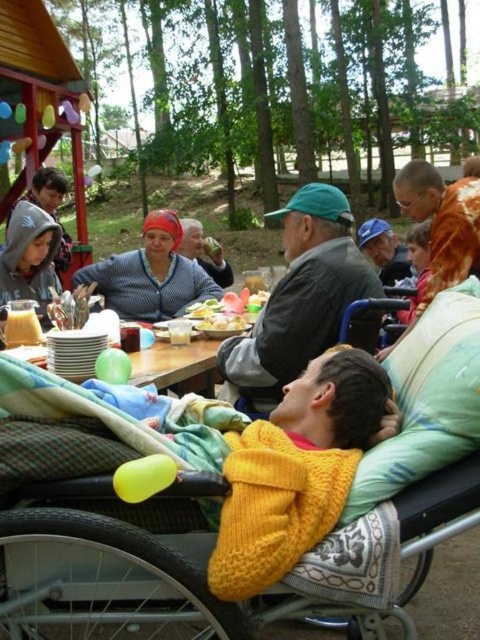
Based on the photo, can you confirm if yellow knitted baby carriage at center is wider than black plastic wheelchair at center?

Yes, yellow knitted baby carriage at center is wider than black plastic wheelchair at center.

Does yellow knitted baby carriage at center appear on the right side of black plastic wheelchair at center?

Incorrect, yellow knitted baby carriage at center is not on the right side of black plastic wheelchair at center.

At what (x,y) coordinates should I click in order to perform the action: click on yellow knitted baby carriage at center. Please return your answer as a coordinate pair (x, y). Image resolution: width=480 pixels, height=640 pixels. Looking at the image, I should click on (215, 532).

Is yellow knitted baby carriage at center wider than matte gray sweater at center?

Correct, the width of yellow knitted baby carriage at center exceeds that of matte gray sweater at center.

Does point (190, 534) come farther from viewer compared to point (216, 240)?

That is False.

This screenshot has height=640, width=480. I want to click on yellow knitted baby carriage at center, so click(215, 532).

Which is below, yellow knitted baby carriage at center or smooth plastic bowl at center?

yellow knitted baby carriage at center

Which is behind, point (108, 522) or point (220, 321)?

Point (220, 321)

Is point (149, 604) farther from camera compared to point (244, 321)?

No, it is not.

At what (x,y) coordinates should I click in order to perform the action: click on yellow knitted baby carriage at center. Please return your answer as a coordinate pair (x, y). Looking at the image, I should click on (x=215, y=532).